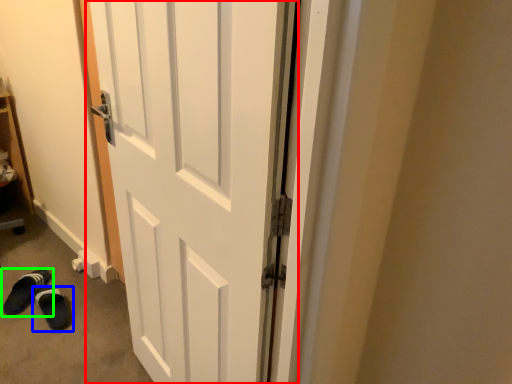
Question: Which is nearer to the door (highlighted by a red box)? footwear (highlighted by a blue box) or footwear (highlighted by a green box).

Choices:
 (A) footwear
 (B) footwear

Answer: (A)